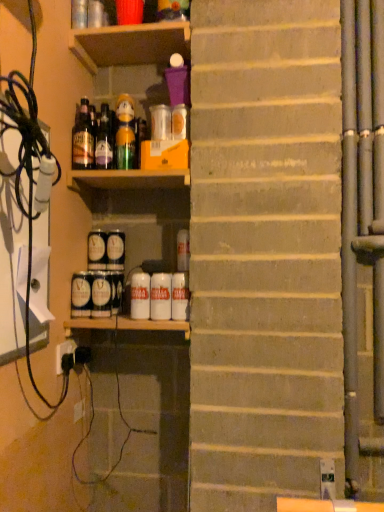
This screenshot has height=512, width=384. What do you see at coordinates (125, 133) in the screenshot?
I see `green glass bottle at upper center, the 1th bottle when ordered from right to left` at bounding box center [125, 133].

In order to face matte black can at center left, the 7th beverage from the right, should I rotate leftwards or rightwards?

Turn left approximately 12.436 degrees to face it.

Describe the element at coordinates (83, 138) in the screenshot. The width and height of the screenshot is (384, 512). I see `matte glass bottle at upper left, arranged as the third bottle when viewed from the right` at that location.

Image resolution: width=384 pixels, height=512 pixels. Identify the location of matte glass bottle at upper left, arranged as the third bottle when viewed from the right. (x=83, y=138).

Measure the distance between matte black can at center, which ranks as the 8th beverage in right-to-left order, and camera.

matte black can at center, which ranks as the 8th beverage in right-to-left order, and camera are 1.35 meters apart.

Locate an element on the screen. The image size is (384, 512). translucent glass bottle at upper left, which is the 2th bottle in left-to-right order is located at coordinates (104, 140).

Image resolution: width=384 pixels, height=512 pixels. Find the location of `bottle that is the 3rd one when counting upward from the matte black can at center, the 4th beverage positioned from the left (from the image's perspective)`. bottle that is the 3rd one when counting upward from the matte black can at center, the 4th beverage positioned from the left (from the image's perspective) is located at coordinates (x=83, y=138).

Is matte glass bottle at upper left, arranged as the third bottle when viewed from the right, far away from matte black can at center, the 4th beverage positioned from the left?

They are positioned close to each other.

Which object is wider, matte glass bottle at upper left, arranged as the third bottle when viewed from the right, or matte black can at center, which is the fifth beverage in right-to-left order?

matte black can at center, which is the fifth beverage in right-to-left order, is wider.

Does matte glass bottle at upper left, arranged as the third bottle when viewed from the right, appear on the left side of matte black can at center, which is the fifth beverage in right-to-left order?

Correct, you'll find matte glass bottle at upper left, arranged as the third bottle when viewed from the right, to the left of matte black can at center, which is the fifth beverage in right-to-left order.

Which object is thinner, blue matte can at lower center, which is counted as the third beverage, starting from the left, or white matte can at center, which is counted as the 2th beverage, starting from the right?

With smaller width is white matte can at center, which is counted as the 2th beverage, starting from the right.

Locate an element on the screen. The width and height of the screenshot is (384, 512). beverage that is the 4th object to the right of the blue matte can at lower center, which is the sixth beverage in right-to-left order, starting at the anchor is located at coordinates (183, 250).

What's the angular difference between blue matte can at lower center, which is counted as the third beverage, starting from the left, and white matte can at center, which is counted as the 2th beverage, starting from the right,'s facing directions?

0.772 degrees.

Is blue matte can at lower center, which is counted as the third beverage, starting from the left, placed right next to white matte can at center, which is counted as the 2th beverage, starting from the right?

No, blue matte can at lower center, which is counted as the third beverage, starting from the left, is not beside white matte can at center, which is counted as the 2th beverage, starting from the right.

Is white matte can at center, which is the 1th beverage in right-to-left order, positioned with its back to green glass bottle at upper center, the 3th bottle in the left-to-right sequence?

That's not correct — white matte can at center, which is the 1th beverage in right-to-left order, is not looking away from green glass bottle at upper center, the 3th bottle in the left-to-right sequence.

From a real-world perspective, which beverage is the 6th one underneath the green glass bottle at upper center, the 1th bottle when ordered from right to left? Please provide its 2D coordinates.

[(180, 296)]

Who is smaller, white matte can at center, which is counted as the eighth beverage, starting from the left, or green glass bottle at upper center, the 3th bottle in the left-to-right sequence?

white matte can at center, which is counted as the eighth beverage, starting from the left.

From the image's perspective, does white matte can at center, which is the 1th beverage in right-to-left order, appear higher than green glass bottle at upper center, the 3th bottle in the left-to-right sequence?

No, from the image's perspective, white matte can at center, which is the 1th beverage in right-to-left order, is not on top of green glass bottle at upper center, the 3th bottle in the left-to-right sequence.

Does matte black can at center, the 4th beverage positioned from the left, have a lesser height compared to matte glass bottle at upper left, which is the first bottle from left to right?

Yes.

In the scene shown: From the image's perspective, is matte black can at center, the 4th beverage positioned from the left, positioned above or below matte glass bottle at upper left, arranged as the third bottle when viewed from the right?

matte black can at center, the 4th beverage positioned from the left, is below matte glass bottle at upper left, arranged as the third bottle when viewed from the right.

How distant is matte black can at center, which is the fifth beverage in right-to-left order, from matte glass bottle at upper left, arranged as the third bottle when viewed from the right?

matte black can at center, which is the fifth beverage in right-to-left order, and matte glass bottle at upper left, arranged as the third bottle when viewed from the right, are 12.55 inches apart.

From the picture: Which object is thinner, matte black can at center, the 4th beverage positioned from the left, or matte glass bottle at upper left, arranged as the third bottle when viewed from the right?

matte glass bottle at upper left, arranged as the third bottle when viewed from the right.

Which of these two, white matte can at center, marked as the 3th beverage in a right-to-left arrangement, or translucent glass bottle at upper left, which is the 2th bottle in left-to-right order, is bigger?

With larger size is translucent glass bottle at upper left, which is the 2th bottle in left-to-right order.

From the picture: From a real-world perspective, is white matte can at center, marked as the 3th beverage in a right-to-left arrangement, on translucent glass bottle at upper left, which is the 2th bottle in left-to-right order?

No, from a real-world perspective, white matte can at center, marked as the 3th beverage in a right-to-left arrangement, is not above translucent glass bottle at upper left, which is the 2th bottle in left-to-right order.

Based on the photo, is white matte can at center, marked as the 3th beverage in a right-to-left arrangement, behind translucent glass bottle at upper left, marked as the second bottle in a right-to-left arrangement?

That is False.

From a real-world perspective, is matte black can at center, which ranks as the 8th beverage in right-to-left order, below white matte can at center, which appears as the 7th beverage when viewed from the left?

Correct, in the physical world, matte black can at center, which ranks as the 8th beverage in right-to-left order, is lower than white matte can at center, which appears as the 7th beverage when viewed from the left.

Between matte black can at center, the first beverage in the left-to-right sequence, and white matte can at center, which is counted as the 2th beverage, starting from the right, which one has larger width?

matte black can at center, the first beverage in the left-to-right sequence.

Is matte black can at center, the first beverage in the left-to-right sequence, next to white matte can at center, which is counted as the 2th beverage, starting from the right, and touching it?

No, matte black can at center, the first beverage in the left-to-right sequence, is not beside white matte can at center, which is counted as the 2th beverage, starting from the right.

From the image's perspective, is matte black can at center, which ranks as the 8th beverage in right-to-left order, beneath white matte can at center, which is counted as the 2th beverage, starting from the right?

Yes, from the image's perspective, matte black can at center, which ranks as the 8th beverage in right-to-left order, is beneath white matte can at center, which is counted as the 2th beverage, starting from the right.

Is point (112, 258) farther from viewer compared to point (106, 239)?

No, it is in front of (106, 239).

Which is more to the right, matte black can at center, the 4th beverage positioned from the left, or matte black can at center left, the 7th beverage from the right?

Positioned to the right is matte black can at center, the 4th beverage positioned from the left.

From a real-world perspective, which is physically above, matte black can at center, the 4th beverage positioned from the left, or matte black can at center left, the 7th beverage from the right?

In real-world perspective, matte black can at center left, the 7th beverage from the right, is above.

Does matte black can at center, which is the fifth beverage in right-to-left order, come behind matte black can at center left, the 2th beverage viewed from the left?

No, matte black can at center, which is the fifth beverage in right-to-left order, is closer to the camera.

From the matte black can at center, which is the fifth beverage in right-to-left order, count the 2nd bottle to the left and point to it. Please provide its 2D coordinates.

[(83, 138)]

You are a GUI agent. You are given a task and a screenshot of the screen. Output one action in this format:
    pyautogui.click(x=<x>, y=<y>)
    Task: Click on the 3rd beverage behind the white matte can at center, which appears as the 7th beverage when viewed from the left
    
    Given the screenshot: What is the action you would take?
    pyautogui.click(x=101, y=294)

Considering their positions, is green glass bottle at upper center, the 1th bottle when ordered from right to left, positioned closer to blue matte can at lower center, which is counted as the third beverage, starting from the left, than matte glass bottle at upper left, arranged as the third bottle when viewed from the right?

matte glass bottle at upper left, arranged as the third bottle when viewed from the right, lies closer to blue matte can at lower center, which is counted as the third beverage, starting from the left, than the other object.

Based on their spatial positions, is matte black can at center left, the 2th beverage viewed from the left, or white matte can at center, which is the 1th beverage in right-to-left order, closer to white matte can at center, which appears as the 7th beverage when viewed from the left?

Based on the image, white matte can at center, which is the 1th beverage in right-to-left order, appears to be nearer to white matte can at center, which appears as the 7th beverage when viewed from the left.

From the image, which object appears to be farther from white matte can at center, which ranks as the 5th beverage in left-to-right order, green glass bottle at upper center, the 1th bottle when ordered from right to left, or matte glass bottle at upper left, which is the first bottle from left to right?

green glass bottle at upper center, the 1th bottle when ordered from right to left, lies further to white matte can at center, which ranks as the 5th beverage in left-to-right order, than the other object.

When comparing their distances from white matte can at center, the fourth beverage when ordered from right to left, does matte glass bottle at upper left, which is the first bottle from left to right, or white matte can at center, marked as the 3th beverage in a right-to-left arrangement, seem closer?

white matte can at center, marked as the 3th beverage in a right-to-left arrangement, is positioned closer to the anchor white matte can at center, the fourth beverage when ordered from right to left.

From the image, which object appears to be nearer to white matte can at center, the fourth beverage when ordered from right to left, green glass bottle at upper center, the 1th bottle when ordered from right to left, or wooden shelf at upper center?

green glass bottle at upper center, the 1th bottle when ordered from right to left, is positioned closer to the anchor white matte can at center, the fourth beverage when ordered from right to left.

Which object lies further to the anchor point matte glass bottle at upper left, arranged as the third bottle when viewed from the right, white matte can at center, which is the 1th beverage in right-to-left order, or matte black can at center, the 4th beverage positioned from the left?

The object further to matte glass bottle at upper left, arranged as the third bottle when viewed from the right, is white matte can at center, which is the 1th beverage in right-to-left order.

From the image, which object appears to be farther from translucent glass bottle at upper left, marked as the second bottle in a right-to-left arrangement, wooden shelf at upper center or matte black can at center, the first beverage in the left-to-right sequence?

matte black can at center, the first beverage in the left-to-right sequence.

Estimate the real-world distances between objects in this image. Which object is further from matte glass bottle at upper left, arranged as the third bottle when viewed from the right, wooden shelf at upper center or white matte can at center, which ranks as the 5th beverage in left-to-right order?

white matte can at center, which ranks as the 5th beverage in left-to-right order, is positioned further to the anchor matte glass bottle at upper left, arranged as the third bottle when viewed from the right.

Image resolution: width=384 pixels, height=512 pixels. What are the coordinates of `bottle between translucent glass bottle at upper left, marked as the second bottle in a right-to-left arrangement, and matte black can at center left, the 7th beverage from the right, from top to bottom` in the screenshot? It's located at (125, 133).

Find the location of a particular element. bottle between translucent glass bottle at upper left, which is the 2th bottle in left-to-right order, and matte black can at center, the 4th beverage positioned from the left, in the up-down direction is located at coordinates (125, 133).

Find the location of `bottle between translucent glass bottle at upper left, which is the 2th bottle in left-to-right order, and white matte can at center, the 6th beverage in the left-to-right sequence, in the vertical direction`. bottle between translucent glass bottle at upper left, which is the 2th bottle in left-to-right order, and white matte can at center, the 6th beverage in the left-to-right sequence, in the vertical direction is located at coordinates (125, 133).

You are a GUI agent. You are given a task and a screenshot of the screen. Output one action in this format:
    pyautogui.click(x=<x>, y=<y>)
    Task: Click on the bottle between translucent glass bottle at upper left, marked as the second bottle in a right-to-left arrangement, and white matte can at center, which is counted as the eighth beverage, starting from the left, in the vertical direction
    
    Given the screenshot: What is the action you would take?
    pyautogui.click(x=125, y=133)